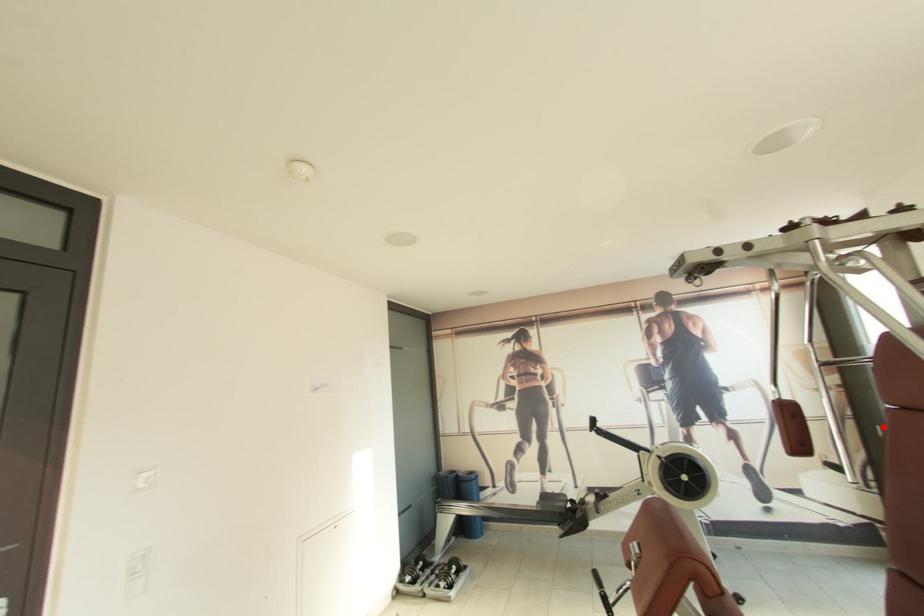
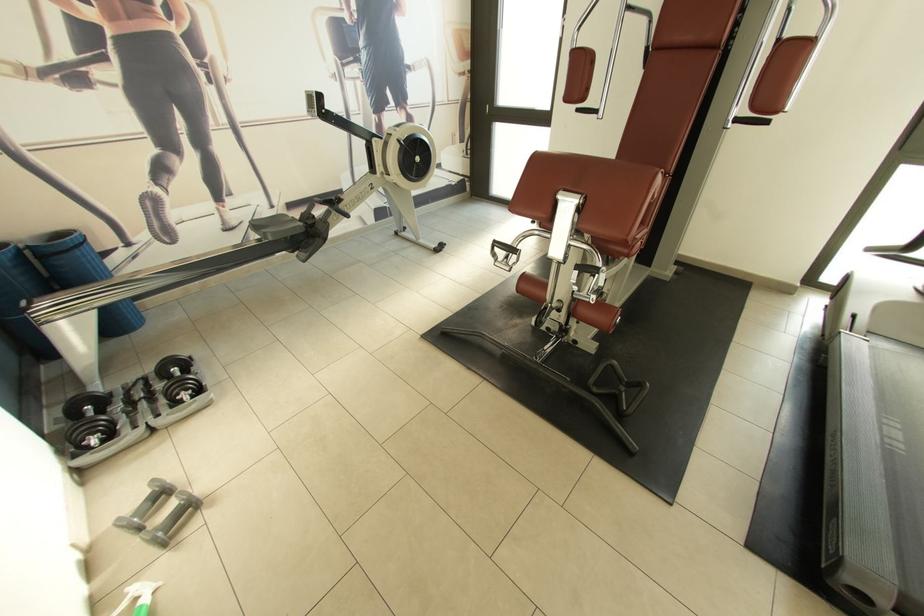
Where in the second image is the point corresponding to the highlighted location from the first image?

(492, 107)